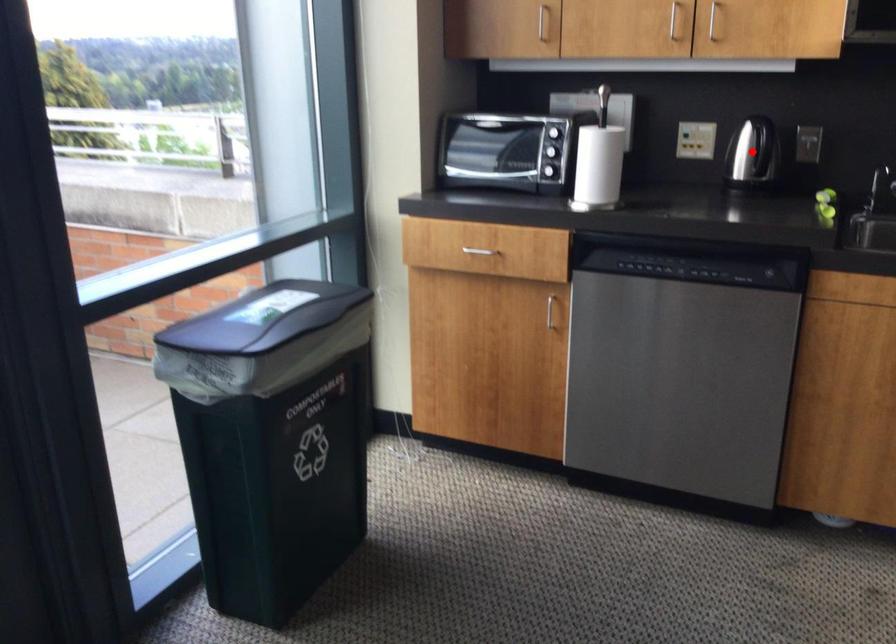
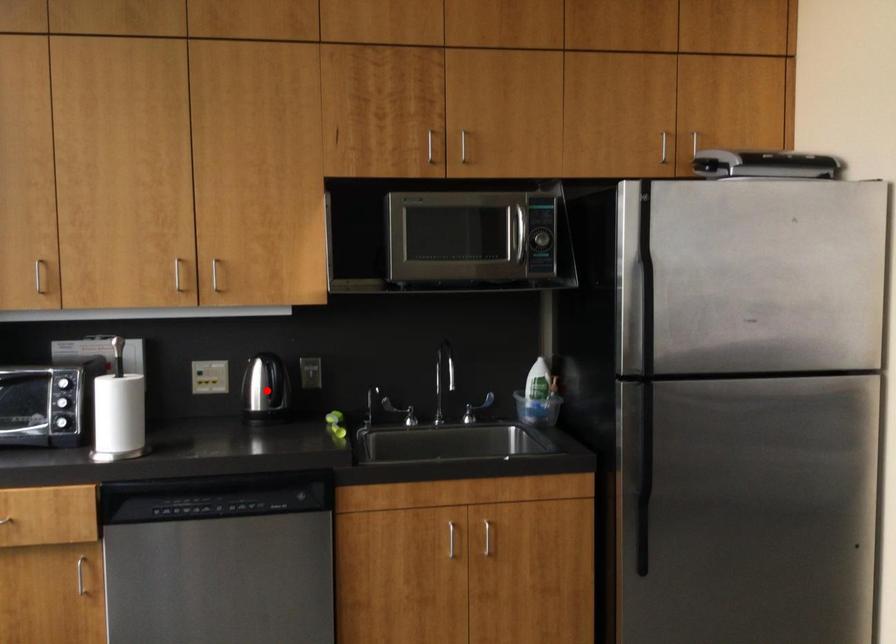
From the picture: I am providing you with two images of the same scene from different viewpoints. A red point is marked on the first image and another point is marked on the second image. Is the marked point in image1 the same physical position as the marked point in image2?

Yes